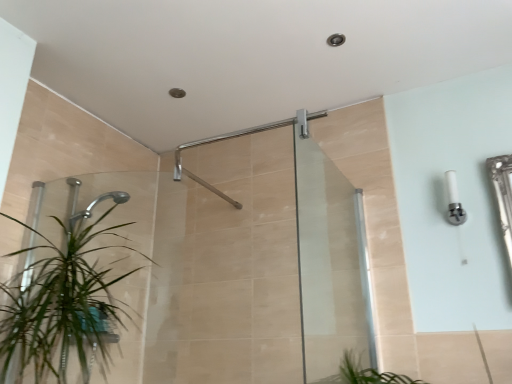
Image resolution: width=512 pixels, height=384 pixels. What do you see at coordinates (330, 262) in the screenshot?
I see `transparent glass screen door at center` at bounding box center [330, 262].

Locate an element on the screen. The height and width of the screenshot is (384, 512). matte silver shower arm at upper center is located at coordinates (199, 179).

The image size is (512, 384). Find the location of `white plastic light fixture at upper right`. white plastic light fixture at upper right is located at coordinates (454, 201).

Considering the relative positions of green leafy plant at left and white plastic light fixture at upper right in the image provided, is green leafy plant at left to the left of white plastic light fixture at upper right from the viewer's perspective?

Yes.

Is green leafy plant at left not near white plastic light fixture at upper right?

Yes, green leafy plant at left is far from white plastic light fixture at upper right.

Is green leafy plant at left bigger than white plastic light fixture at upper right?

Yes, green leafy plant at left is bigger than white plastic light fixture at upper right.

Is green leafy plant at left shorter than white plastic light fixture at upper right?

No, green leafy plant at left is not shorter than white plastic light fixture at upper right.

Based on the photo, is matte silver shower arm at upper center turned away from transparent glass screen door at center?

No, matte silver shower arm at upper center is not facing the opposite direction of transparent glass screen door at center.

Locate an element on the screen. This screenshot has width=512, height=384. shower behind the transparent glass screen door at center is located at coordinates (199, 179).

From their relative heights in the image, would you say matte silver shower arm at upper center is taller or shorter than transparent glass screen door at center?

matte silver shower arm at upper center is shorter than transparent glass screen door at center.

From the image's perspective, is transparent glass screen door at center located above or below white plastic light fixture at upper right?

Based on their image positions, transparent glass screen door at center is located beneath white plastic light fixture at upper right.

Considering the positions of point (330, 210) and point (456, 213), is point (330, 210) closer or farther from the camera than point (456, 213)?

Point (330, 210).

Relative to white plastic light fixture at upper right, is transparent glass screen door at center in front or behind?

transparent glass screen door at center is in front of white plastic light fixture at upper right.

Image resolution: width=512 pixels, height=384 pixels. Find the location of `light fixture on the right of transparent glass screen door at center`. light fixture on the right of transparent glass screen door at center is located at coordinates (454, 201).

Image resolution: width=512 pixels, height=384 pixels. What are the coordinates of `screen door in front of the white plastic light fixture at upper right` in the screenshot? It's located at (330, 262).

Could you measure the distance between white plastic light fixture at upper right and transparent glass screen door at center?

white plastic light fixture at upper right is 24.38 inches from transparent glass screen door at center.

Between white plastic light fixture at upper right and transparent glass screen door at center, which one appears on the left side from the viewer's perspective?

transparent glass screen door at center is more to the left.

Considering the sizes of objects white plastic light fixture at upper right and transparent glass screen door at center in the image provided, who is shorter, white plastic light fixture at upper right or transparent glass screen door at center?

white plastic light fixture at upper right.

Are transparent glass screen door at center and matte silver shower arm at upper center far apart?

No.

Is transparent glass screen door at center oriented towards matte silver shower arm at upper center?

No, transparent glass screen door at center is not aimed at matte silver shower arm at upper center.

From the picture: How distant is transparent glass screen door at center from matte silver shower arm at upper center?

transparent glass screen door at center and matte silver shower arm at upper center are 27.34 inches apart.

Identify the location of shower behind the transparent glass screen door at center. (199, 179).

Looking at this image, based on their sizes in the image, would you say white plastic light fixture at upper right is bigger or smaller than matte silver shower arm at upper center?

In the image, white plastic light fixture at upper right appears to be smaller than matte silver shower arm at upper center.

Looking at this image, considering the relative sizes of white plastic light fixture at upper right and matte silver shower arm at upper center in the image provided, is white plastic light fixture at upper right shorter than matte silver shower arm at upper center?

No, white plastic light fixture at upper right is not shorter than matte silver shower arm at upper center.

Would you say white plastic light fixture at upper right contains matte silver shower arm at upper center?

No, matte silver shower arm at upper center is not surrounded by white plastic light fixture at upper right.

Identify the location of shower that appears behind the white plastic light fixture at upper right. This screenshot has height=384, width=512. (199, 179).

Would you say transparent glass screen door at center is outside green leafy plant at left?

Yes, transparent glass screen door at center is outside of green leafy plant at left.

Can you confirm if transparent glass screen door at center is shorter than green leafy plant at left?

No, transparent glass screen door at center is not shorter than green leafy plant at left.

From a real-world perspective, is transparent glass screen door at center physically above green leafy plant at left?

Correct, in the physical world, transparent glass screen door at center is higher than green leafy plant at left.

Can you confirm if transparent glass screen door at center is bigger than green leafy plant at left?

Incorrect, transparent glass screen door at center is not larger than green leafy plant at left.

In order to click on light fixture to the right of green leafy plant at left in this screenshot , I will do `click(454, 201)`.

At what (x,y) coordinates should I click in order to perform the action: click on screen door in front of the matte silver shower arm at upper center. Please return your answer as a coordinate pair (x, y). The image size is (512, 384). Looking at the image, I should click on (330, 262).

Considering their positions, is transparent glass screen door at center positioned further to matte silver shower arm at upper center than white plastic light fixture at upper right?

white plastic light fixture at upper right is further to matte silver shower arm at upper center.

Considering their positions, is transparent glass screen door at center positioned further to white plastic light fixture at upper right than green leafy plant at left?

green leafy plant at left lies further to white plastic light fixture at upper right than the other object.

When comparing their distances from green leafy plant at left, does transparent glass screen door at center or matte silver shower arm at upper center seem further?

transparent glass screen door at center.

From the image, which object appears to be farther from matte silver shower arm at upper center, green leafy plant at left or transparent glass screen door at center?

The object further to matte silver shower arm at upper center is green leafy plant at left.

Based on their spatial positions, is white plastic light fixture at upper right or green leafy plant at left closer to transparent glass screen door at center?

Based on the image, white plastic light fixture at upper right appears to be nearer to transparent glass screen door at center.

When comparing their distances from green leafy plant at left, does matte silver shower arm at upper center or transparent glass screen door at center seem further?

Based on the image, transparent glass screen door at center appears to be further to green leafy plant at left.

Considering their positions, is green leafy plant at left positioned closer to white plastic light fixture at upper right than transparent glass screen door at center?

Among the two, transparent glass screen door at center is located nearer to white plastic light fixture at upper right.

When comparing their distances from white plastic light fixture at upper right, does matte silver shower arm at upper center or transparent glass screen door at center seem further?

Among the two, matte silver shower arm at upper center is located further to white plastic light fixture at upper right.

Where is `screen door situated between matte silver shower arm at upper center and white plastic light fixture at upper right from left to right`? screen door situated between matte silver shower arm at upper center and white plastic light fixture at upper right from left to right is located at coordinates (330, 262).

Image resolution: width=512 pixels, height=384 pixels. What are the coordinates of `shower between green leafy plant at left and white plastic light fixture at upper right in the horizontal direction` in the screenshot? It's located at (199, 179).

The image size is (512, 384). In order to click on screen door located between green leafy plant at left and white plastic light fixture at upper right in the left-right direction in this screenshot , I will do `click(330, 262)`.

Locate an element on the screen. The width and height of the screenshot is (512, 384). shower between green leafy plant at left and transparent glass screen door at center is located at coordinates (199, 179).